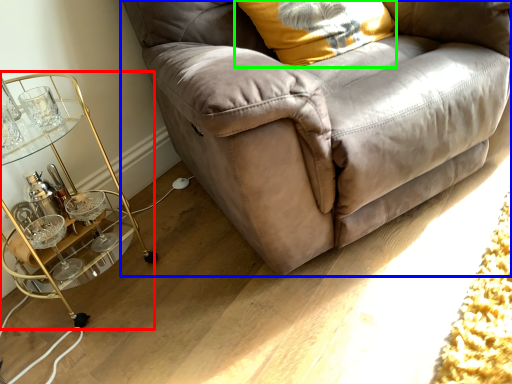
Question: Which object is the closest to the table (highlighted by a red box)? Choose among these: studio couch (highlighted by a blue box) or pillow (highlighted by a green box).

Choices:
 (A) studio couch
 (B) pillow

Answer: (A)